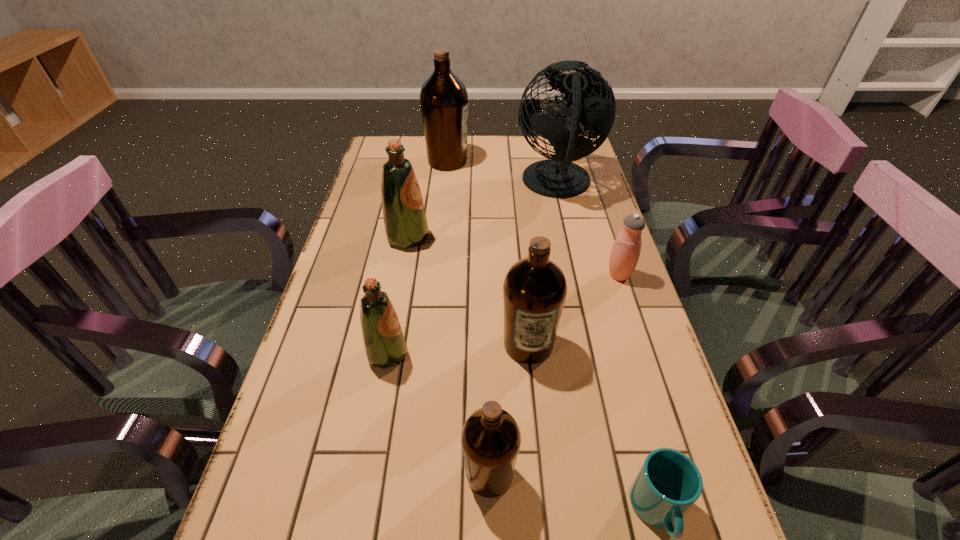
Identify the location of the fourth farthest object. (625, 252).

The height and width of the screenshot is (540, 960). Find the location of `free location located 0.380m on the front-facing side of the globe`. free location located 0.380m on the front-facing side of the globe is located at coordinates (401, 184).

Identify the location of free region located on the front-facing side of the globe. (440, 184).

This screenshot has height=540, width=960. Identify the location of vacant space situated on the front-facing side of the globe. (417, 184).

Where is `free space located 0.230m on the label of the farthest olive oil`? Image resolution: width=960 pixels, height=540 pixels. free space located 0.230m on the label of the farthest olive oil is located at coordinates (534, 161).

Identify the location of free space located 0.060m on the front-facing side of the sixth nearest object. (450, 238).

In order to click on free spot located 0.090m on the label of the second farthest brown olive oil in this screenshot , I will do `click(535, 406)`.

Locate an element on the screen. The height and width of the screenshot is (540, 960). vacant space located on the front-facing side of the nearer green olive oil is located at coordinates (471, 354).

At what (x,y) coordinates should I click in order to perform the action: click on blank space located 0.210m on the label of the nearest brown olive oil. Please return your answer as a coordinate pair (x, y). Image resolution: width=960 pixels, height=540 pixels. Looking at the image, I should click on (347, 474).

Locate an element on the screen. This screenshot has width=960, height=540. vacant region located on the label of the nearest brown olive oil is located at coordinates (408, 474).